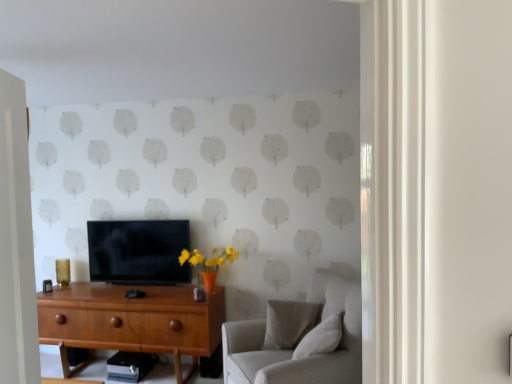
Question: Considering the relative sizes of light gray fabric pillow at center, arranged as the 2th pillow when viewed from the front, and wooden desk at center in the image provided, is light gray fabric pillow at center, arranged as the 2th pillow when viewed from the front, thinner than wooden desk at center?

Choices:
 (A) no
 (B) yes

Answer: (B)

Question: Would you say light gray fabric pillow at center, positioned as the 1th pillow in back-to-front order, contains wooden desk at center?

Choices:
 (A) yes
 (B) no

Answer: (B)

Question: Is light gray fabric pillow at center, arranged as the 2th pillow when viewed from the front, shorter than wooden desk at center?

Choices:
 (A) no
 (B) yes

Answer: (B)

Question: From a real-world perspective, is light gray fabric pillow at center, positioned as the 1th pillow in back-to-front order, beneath wooden desk at center?

Choices:
 (A) no
 (B) yes

Answer: (A)

Question: Is light gray fabric pillow at center, arranged as the 2th pillow when viewed from the front, directly adjacent to wooden desk at center?

Choices:
 (A) no
 (B) yes

Answer: (A)

Question: Is white textured pillow at lower right, which is the first pillow from front to back, wider or thinner than light gray fabric couch at right?

Choices:
 (A) thin
 (B) wide

Answer: (A)

Question: Considering the positions of white textured pillow at lower right, which is the first pillow from front to back, and light gray fabric couch at right in the image, is white textured pillow at lower right, which is the first pillow from front to back, bigger or smaller than light gray fabric couch at right?

Choices:
 (A) small
 (B) big

Answer: (A)

Question: From a real-world perspective, is white textured pillow at lower right, which is the first pillow from front to back, physically located above or below light gray fabric couch at right?

Choices:
 (A) above
 (B) below

Answer: (A)

Question: Considering the positions of white textured pillow at lower right, which is the first pillow from front to back, and light gray fabric couch at right in the image, is white textured pillow at lower right, which is the first pillow from front to back, taller or shorter than light gray fabric couch at right?

Choices:
 (A) tall
 (B) short

Answer: (B)

Question: Looking at the image, does matte black tv at center seem bigger or smaller compared to light gray fabric pillow at center, positioned as the 1th pillow in back-to-front order?

Choices:
 (A) big
 (B) small

Answer: (A)

Question: From a real-world perspective, relative to light gray fabric pillow at center, arranged as the 2th pillow when viewed from the front, is matte black tv at center vertically above or below?

Choices:
 (A) below
 (B) above

Answer: (B)

Question: From the image's perspective, is matte black tv at center located above or below light gray fabric pillow at center, arranged as the 2th pillow when viewed from the front?

Choices:
 (A) above
 (B) below

Answer: (A)

Question: Would you say matte black tv at center is to the left or to the right of light gray fabric pillow at center, arranged as the 2th pillow when viewed from the front, in the picture?

Choices:
 (A) left
 (B) right

Answer: (A)

Question: From the image's perspective, is light gray fabric couch at right located above or below wooden desk at center?

Choices:
 (A) above
 (B) below

Answer: (A)

Question: Considering the positions of light gray fabric couch at right and wooden desk at center in the image, is light gray fabric couch at right bigger or smaller than wooden desk at center?

Choices:
 (A) small
 (B) big

Answer: (B)